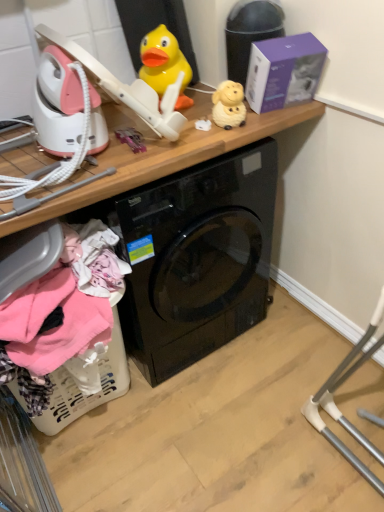
This screenshot has height=512, width=384. Find the location of `vacant area that is in front of white plastic laundry basket at lower left`. vacant area that is in front of white plastic laundry basket at lower left is located at coordinates (129, 479).